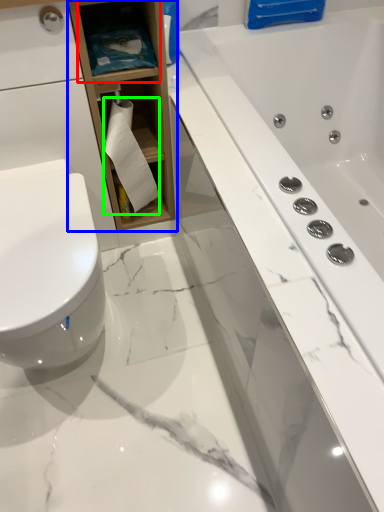
Question: Which object is the closest to the shelf (highlighted by a red box)? Choose among these: bathroom cabinet (highlighted by a blue box) or toilet paper (highlighted by a green box).

Choices:
 (A) bathroom cabinet
 (B) toilet paper

Answer: (A)